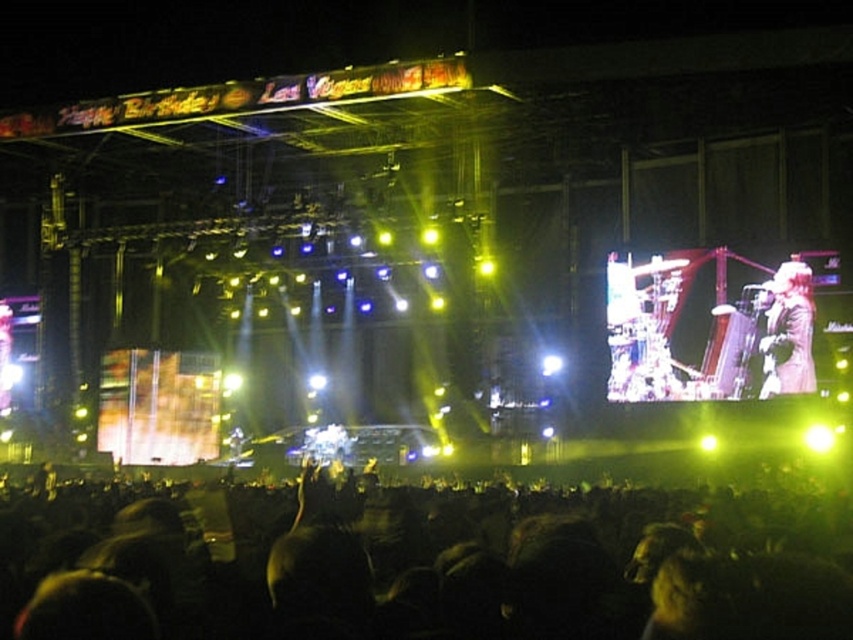
In the scene shown: You are a photographer at the concert and want to capture a photo that includes both the black matte crowd at lower center and the shiny black jacket at right. Since you want the crowd to be the main focus, which object should you position closer to the center of the frame?

The black matte crowd at lower center should be positioned closer to the center of the frame because its width is larger than the shiny black jacket at right, making it more prominent and suitable as the main focus.

You are a photographer trying to capture the crowd at the concert. You notice a point marked at coordinates (409, 563). What is the color and material of the crowd at that location?

The point (409, 563) indicates the black matte crowd at lower center, so the crowd there is black and matte in appearance.

You are standing at the front of the stage and want to move towards the back. Which point, point (515,612) or point (787,296), would you encounter first?

Point (515,612) is in front of point (787,296), so you would encounter point (515,612) first when moving from the front of the stage to the back.